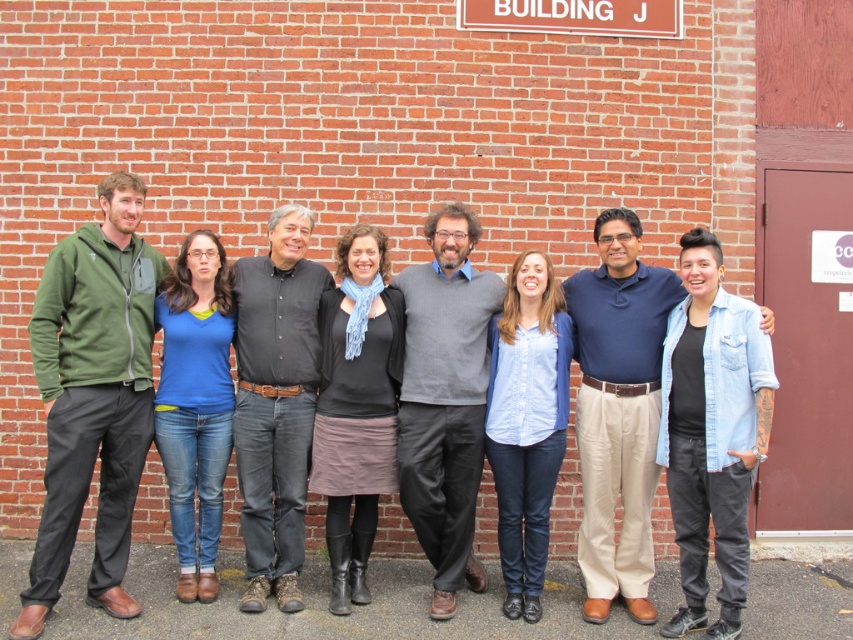
Question: Does blue shirt at center lie behind gray sweater at center?

Choices:
 (A) no
 (B) yes

Answer: (B)

Question: Can you confirm if blue shirt at center is positioned to the left of black cotton shirt at center?

Choices:
 (A) no
 (B) yes

Answer: (A)

Question: Which point is farther to the camera?

Choices:
 (A) blue shirt at center
 (B) gray sweater at center
 (C) black cotton shirt at center
 (D) olive green fleece jacket at left

Answer: (A)

Question: Which of the following is the farthest from the observer?

Choices:
 (A) gray sweater at center
 (B) blue shirt at center
 (C) black cotton shirt at center

Answer: (B)

Question: Can you confirm if olive green fleece jacket at left is positioned above blue shirt at center?

Choices:
 (A) no
 (B) yes

Answer: (B)

Question: Which object appears farthest from the camera in this image?

Choices:
 (A) black cotton shirt at center
 (B) gray sweater at center
 (C) olive green fleece jacket at left

Answer: (A)